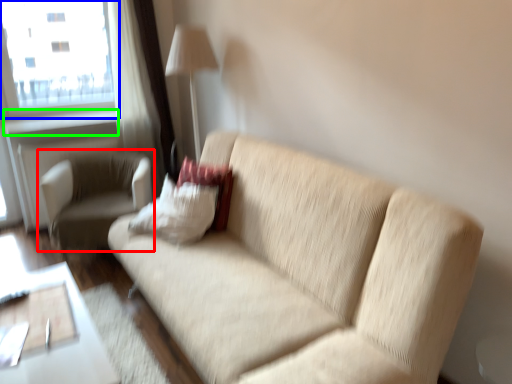
Question: Which is nearer to the chair (highlighted by a red box)? window (highlighted by a blue box) or window sill (highlighted by a green box).

Choices:
 (A) window
 (B) window sill

Answer: (B)